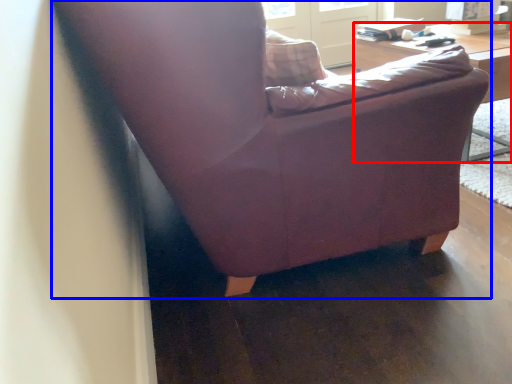
Question: Which point is closer to the camera, table (highlighted by a red box) or chair (highlighted by a blue box)?

Choices:
 (A) table
 (B) chair

Answer: (B)